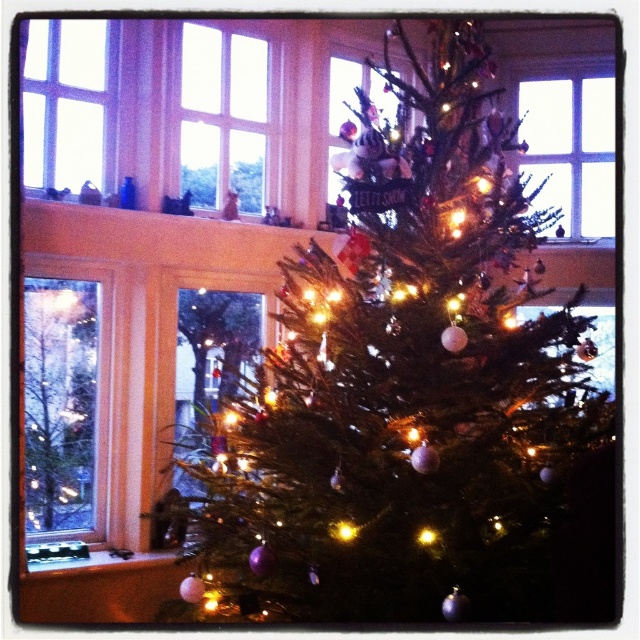
You are planning to move the shiny green pine tree at center closer to the clear glass window at upper left. Given their current widths, will the tree fit entirely within the space occupied by the window without overlapping?

The shiny green pine tree at center is wider than the clear glass window at upper left, so it will not fit entirely within the window space without overlapping.

You are standing in the room where the Christmas tree is placed. You want to check if the transparent glass window at left is located at the top left corner of the room. Based on the coordinates provided, can you confirm its position?

The transparent glass window at left is located at coordinates point (60,403), which is not at the top left corner of the room.